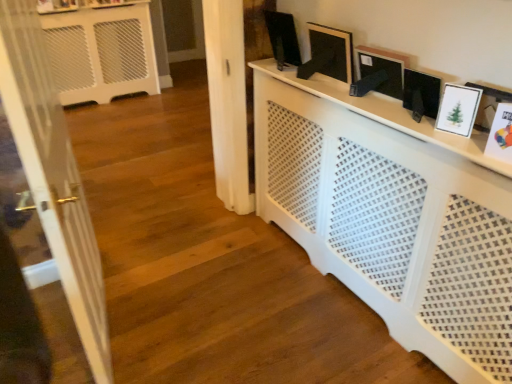
Where is `blank space to the left of white paper picture frame at right, which is the first picture frame in front-to-back order`? This screenshot has height=384, width=512. blank space to the left of white paper picture frame at right, which is the first picture frame in front-to-back order is located at coordinates (473, 150).